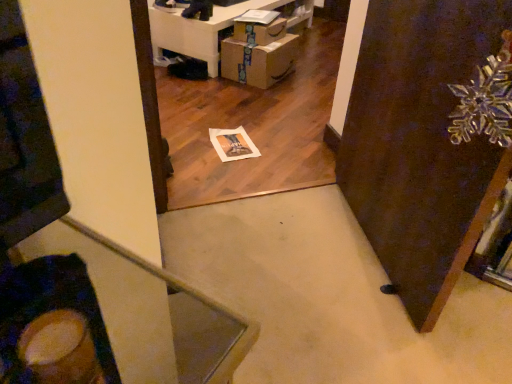
Question: Does cardboard box at center appear on the left side of transparent glass snowflake at upper right?

Choices:
 (A) no
 (B) yes

Answer: (B)

Question: From a real-world perspective, is cardboard box at center on transparent glass snowflake at upper right?

Choices:
 (A) no
 (B) yes

Answer: (A)

Question: Is cardboard box at center directly adjacent to transparent glass snowflake at upper right?

Choices:
 (A) no
 (B) yes

Answer: (A)

Question: Can you confirm if cardboard box at center is positioned to the right of transparent glass snowflake at upper right?

Choices:
 (A) yes
 (B) no

Answer: (B)

Question: Does cardboard box at center have a lesser width compared to transparent glass snowflake at upper right?

Choices:
 (A) no
 (B) yes

Answer: (A)

Question: From a real-world perspective, is cardboard box at center under transparent glass snowflake at upper right?

Choices:
 (A) yes
 (B) no

Answer: (A)

Question: Is transparent glass snowflake at upper right located within cardboard boxes at lower center?

Choices:
 (A) yes
 (B) no

Answer: (B)

Question: Considering the relative sizes of cardboard boxes at lower center and transparent glass snowflake at upper right in the image provided, is cardboard boxes at lower center thinner than transparent glass snowflake at upper right?

Choices:
 (A) yes
 (B) no

Answer: (B)

Question: Does cardboard boxes at lower center have a greater width compared to transparent glass snowflake at upper right?

Choices:
 (A) no
 (B) yes

Answer: (B)

Question: From a real-world perspective, is cardboard boxes at lower center positioned under transparent glass snowflake at upper right based on gravity?

Choices:
 (A) no
 (B) yes

Answer: (B)

Question: Does cardboard boxes at lower center have a larger size compared to transparent glass snowflake at upper right?

Choices:
 (A) yes
 (B) no

Answer: (A)

Question: Is cardboard boxes at lower center next to transparent glass snowflake at upper right and touching it?

Choices:
 (A) yes
 (B) no

Answer: (B)

Question: Are transparent glass snowflake at upper right and cardboard boxes at lower center making contact?

Choices:
 (A) yes
 (B) no

Answer: (B)